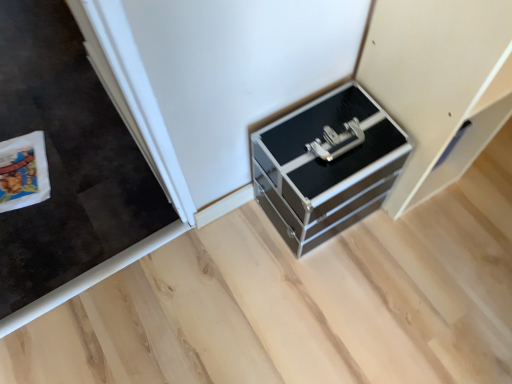
Where is `free space that is in between metallic silver drawer at lower right and metallic black chest of drawers at center`? The width and height of the screenshot is (512, 384). free space that is in between metallic silver drawer at lower right and metallic black chest of drawers at center is located at coordinates (361, 238).